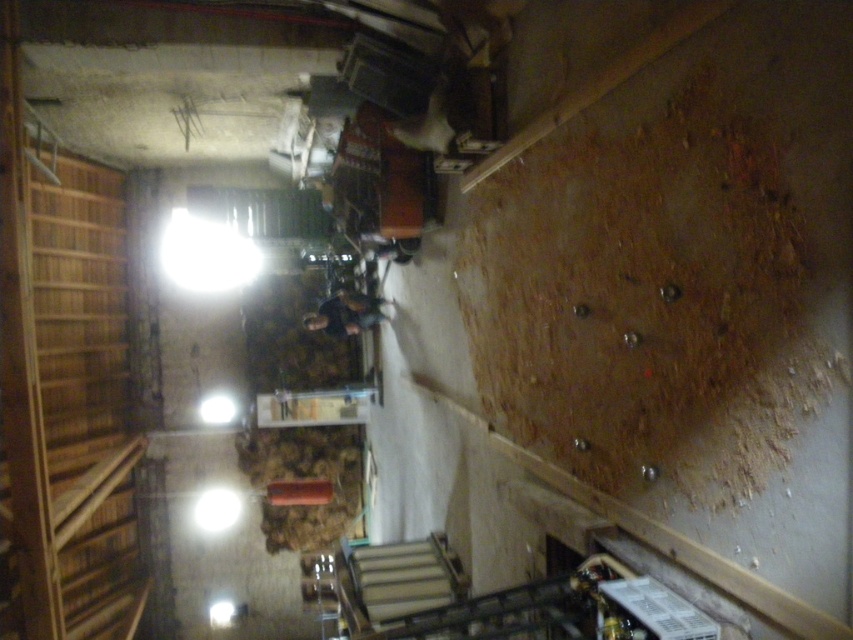
Question: Can you confirm if wooden stairs at left is wider than dark gray fabric jacket at center?

Choices:
 (A) no
 (B) yes

Answer: (A)

Question: Which of the following is the closest to the observer?

Choices:
 (A) (109, 358)
 (B) (318, 305)

Answer: (B)

Question: Is the position of wooden stairs at left more distant than that of dark gray fabric jacket at center?

Choices:
 (A) yes
 (B) no

Answer: (A)

Question: From the image, what is the correct spatial relationship of wooden stairs at left in relation to dark gray fabric jacket at center?

Choices:
 (A) above
 (B) below

Answer: (B)